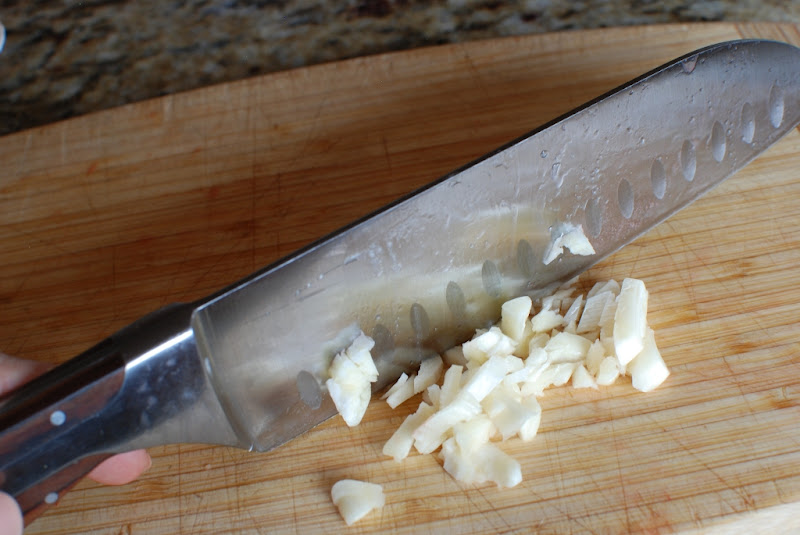
I want to click on gouges in wood, so click(174, 500), click(626, 496), click(682, 441), click(250, 102).